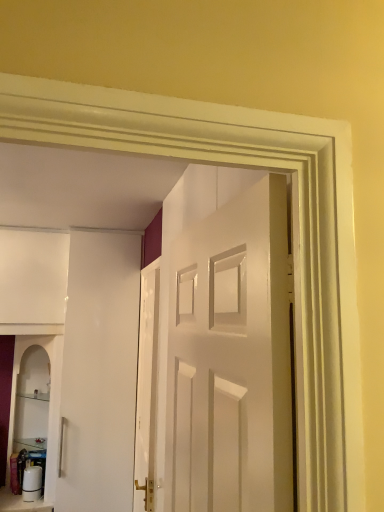
Question: In terms of height, does white glossy door at center, the second door in the back-to-front sequence, look taller or shorter compared to white glossy cabinet at lower left?

Choices:
 (A) tall
 (B) short

Answer: (A)

Question: Is white glossy door at center, the second door in the back-to-front sequence, in front of or behind white glossy cabinet at lower left in the image?

Choices:
 (A) front
 (B) behind

Answer: (A)

Question: Which object is positioned closest to the white glossy water bottle at lower left?

Choices:
 (A) white glossy cabinet at lower left
 (B) white glossy door at center, the 1th door viewed from the left
 (C) white glossy door at center, the second door in the back-to-front sequence

Answer: (A)

Question: Estimate the real-world distances between objects in this image. Which object is farther from the white glossy cabinet at lower left?

Choices:
 (A) white glossy door at center, the 1th door viewed from the left
 (B) white glossy water bottle at lower left
 (C) white glossy door at center, positioned as the first door in right-to-left order

Answer: (C)